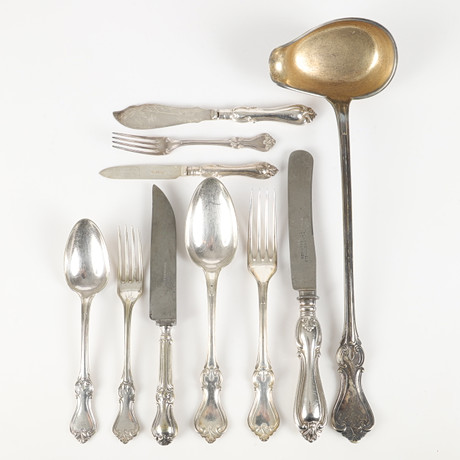
Where is `utensils`? Image resolution: width=460 pixels, height=460 pixels. utensils is located at coordinates (84, 265), (131, 293), (161, 290), (212, 256), (261, 268), (299, 255), (190, 170), (162, 145), (156, 116), (341, 77).